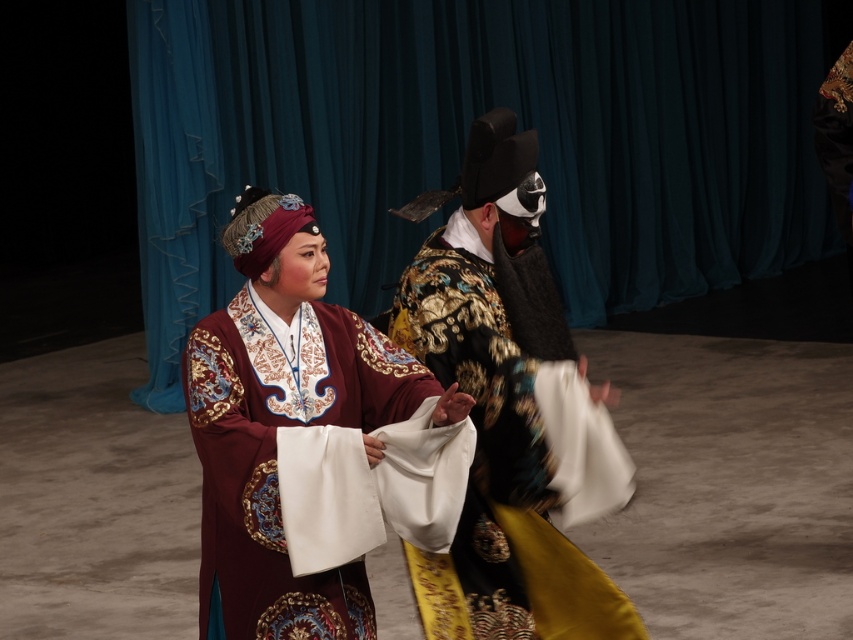
In the scene shown: Does gold brocade robe at center have a greater height compared to velvet maroon robe at center?

Yes, gold brocade robe at center is taller than velvet maroon robe at center.

Who is higher up, gold brocade robe at center or velvet maroon robe at center?

Positioned higher is gold brocade robe at center.

Measure the distance between gold brocade robe at center and camera.

9.18 feet

Find the location of a particular element. gold brocade robe at center is located at coordinates (498, 404).